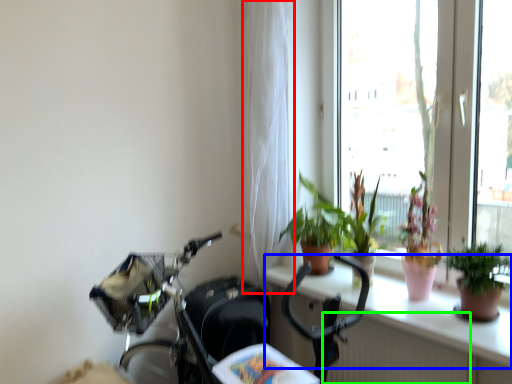
Question: Which object is the closest to the curtain (highlighted by a red box)? Choose among these: window sill (highlighted by a blue box) or radiator (highlighted by a green box).

Choices:
 (A) window sill
 (B) radiator

Answer: (A)